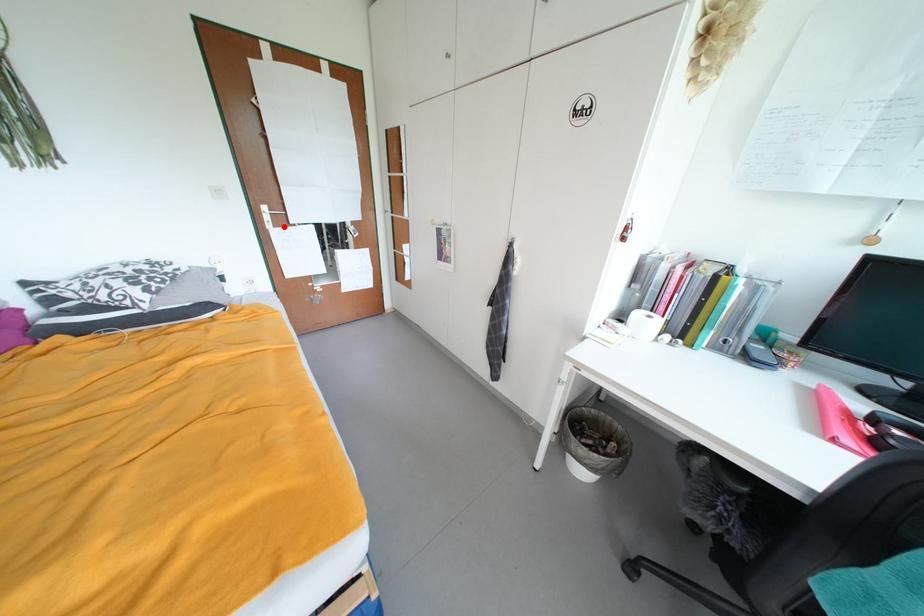
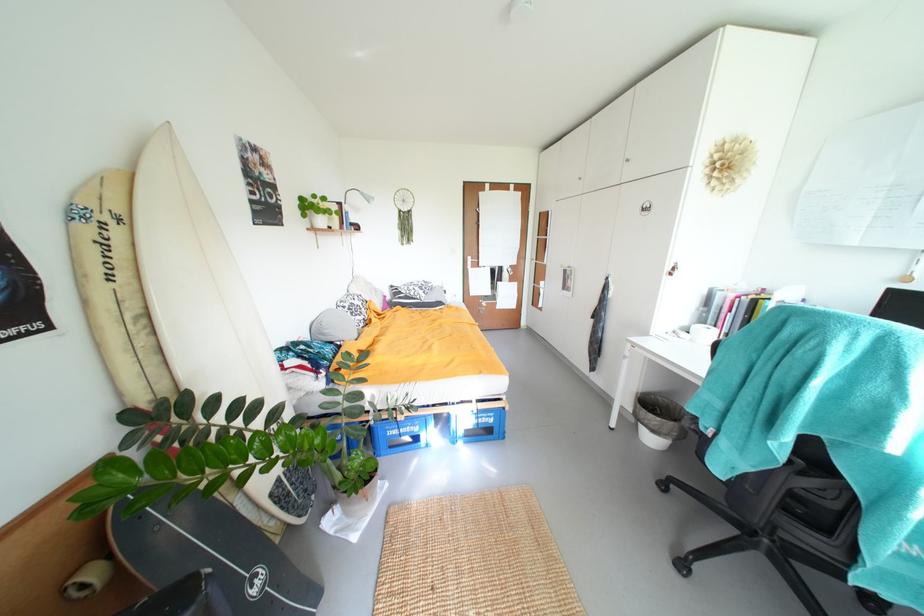
Question: A red point is marked in image1. In image2, is the corresponding 3D point closer to the camera or farther? Reply with the corresponding letter.

Choices:
 (A) The corresponding 3D point is closer.
 (B) The corresponding 3D point is farther.

Answer: (B)